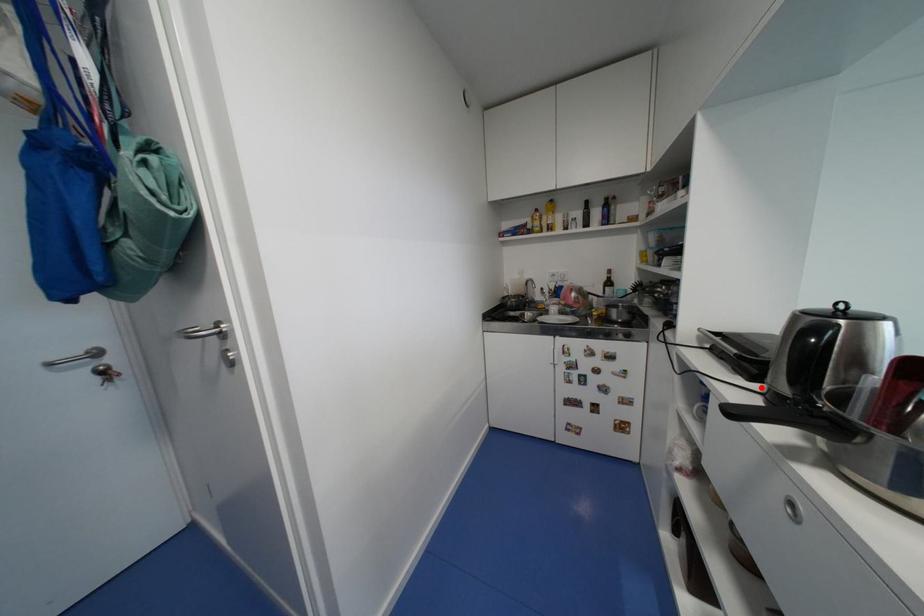
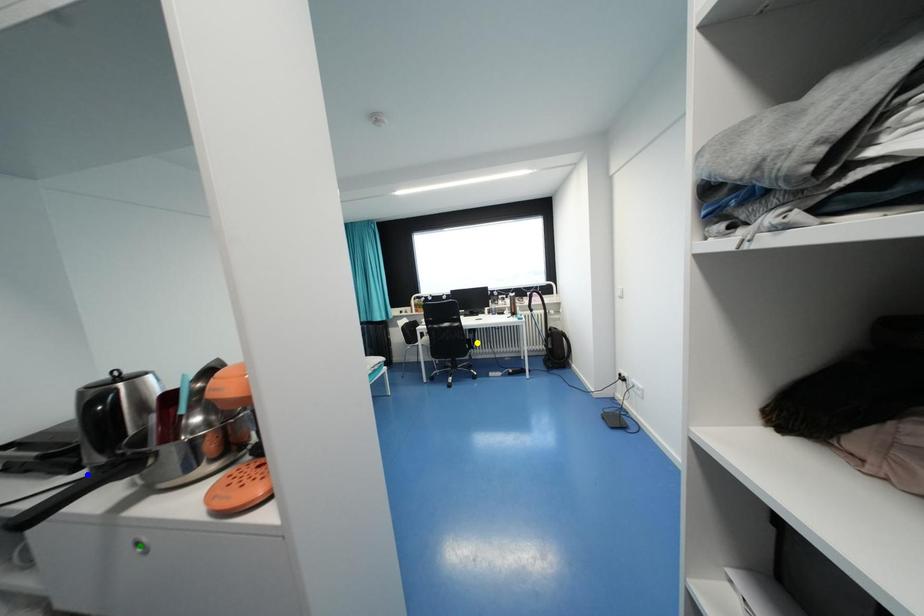
Question: I am providing you with two images of the same scene from different viewpoints. A red point is marked on the first image. You are given multiple points on the second image. Which point in image 2 is actually the same real-world point as the red point in image 1?

Choices:
 (A) green point
 (B) blue point
 (C) yellow point

Answer: (B)